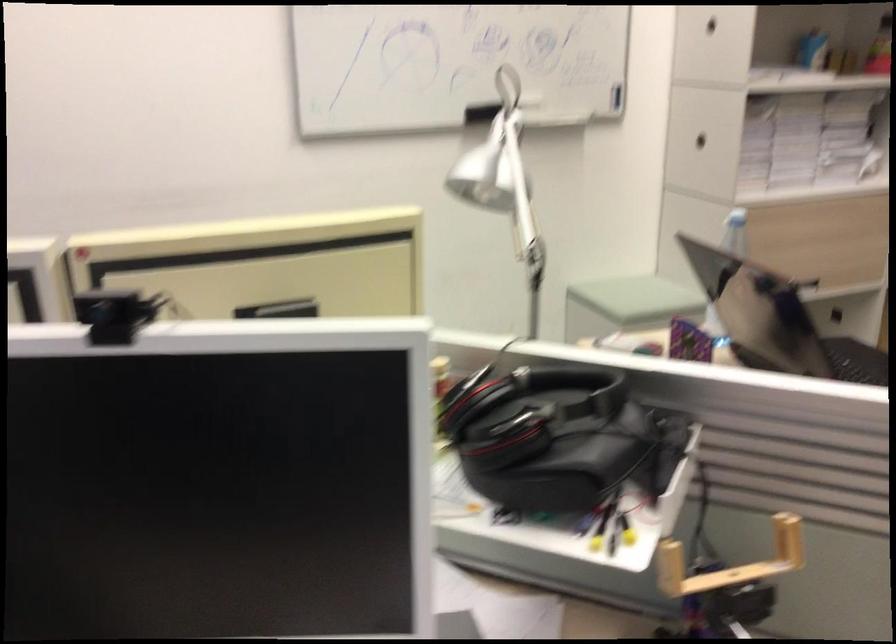
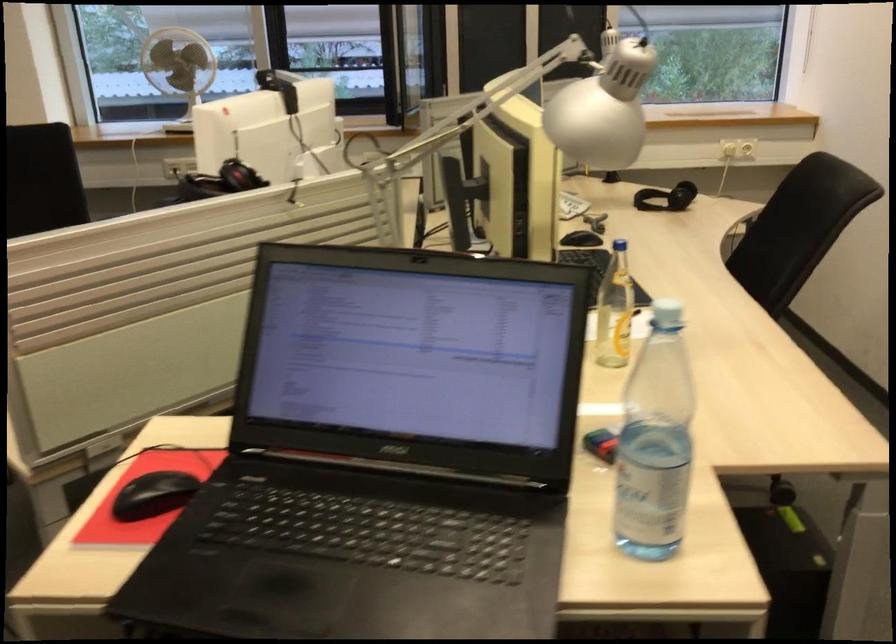
Where in the second image is the point corresponding to point 433,419 from the first image?

(220, 182)